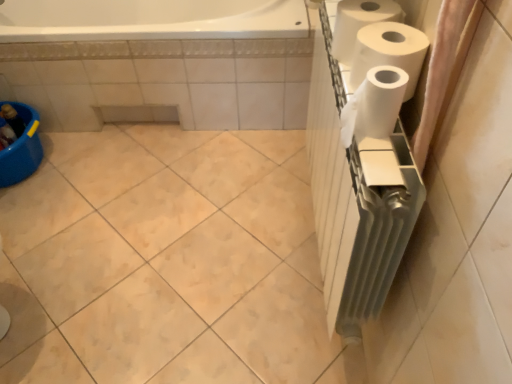
In order to click on white matte paper towel at right, which is the first paper towel in front-to-back order in this screenshot , I will do `click(374, 105)`.

How many degrees apart are the facing directions of white matte paper towel at right, the third paper towel when ordered from back to front, and white matte paper towel at upper right, the first paper towel in the back-to-front sequence?

A: The angle between the facing direction of white matte paper towel at right, the third paper towel when ordered from back to front, and the facing direction of white matte paper towel at upper right, the first paper towel in the back-to-front sequence, is 0.0052 degrees.

From the picture: How much distance is there between white matte paper towel at right, the third paper towel when ordered from back to front, and white matte paper towel at upper right, the first paper towel in the back-to-front sequence?

white matte paper towel at right, the third paper towel when ordered from back to front, and white matte paper towel at upper right, the first paper towel in the back-to-front sequence, are 6.44 inches apart from each other.

From a real-world perspective, which paper towel is the 2nd one underneath the white matte paper towel at right, the third paper towel when ordered from back to front? Please provide its 2D coordinates.

[(359, 23)]

From the image's perspective, is white matte paper towel at right, the third paper towel when ordered from back to front, located above white matte paper towel at upper right, the first paper towel in the back-to-front sequence?

Actually, white matte paper towel at right, the third paper towel when ordered from back to front, appears below white matte paper towel at upper right, the first paper towel in the back-to-front sequence, in the image.

Which is more distant, [355,10] or [371,33]?

The point [355,10] is farther.

Which of these two, white matte paper towel at upper right, placed as the third paper towel when sorted from front to back, or white matte paper towel at right, the second paper towel in the back-to-front sequence, is wider?

With larger width is white matte paper towel at right, the second paper towel in the back-to-front sequence.

Is white matte paper towel at upper right, placed as the third paper towel when sorted from front to back, bigger than white matte paper towel at right, which is the 2th paper towel in front-to-back order?

Incorrect, white matte paper towel at upper right, placed as the third paper towel when sorted from front to back, is not larger than white matte paper towel at right, which is the 2th paper towel in front-to-back order.

In the scene shown: Which of these two, white matte paper towel at upper right, the first paper towel in the back-to-front sequence, or white matte paper towel at right, which is the 2th paper towel in front-to-back order, stands shorter?

white matte paper towel at upper right, the first paper towel in the back-to-front sequence.

Is point (383, 2) closer or farther from the camera than point (368, 100)?

Point (383, 2) is farther from the camera than point (368, 100).

From the image's perspective, does white matte paper towel at upper right, placed as the third paper towel when sorted from front to back, appear higher than white matte paper towel at right, the third paper towel when ordered from back to front?

Yes.

Is white matte paper towel at upper right, the first paper towel in the back-to-front sequence, inside or outside of white matte paper towel at right, which is the first paper towel in front-to-back order?

white matte paper towel at upper right, the first paper towel in the back-to-front sequence, cannot be found inside white matte paper towel at right, which is the first paper towel in front-to-back order.

Could you tell me if pink fabric shower curtain at right is turned towards white matte paper towel at upper right, placed as the third paper towel when sorted from front to back?

No, pink fabric shower curtain at right is not facing towards white matte paper towel at upper right, placed as the third paper towel when sorted from front to back.

Locate an element on the screen. paper towel that is the 2nd one when counting upward from the pink fabric shower curtain at right (from the image's perspective) is located at coordinates (359, 23).

Considering the relative sizes of pink fabric shower curtain at right and white matte paper towel at upper right, the first paper towel in the back-to-front sequence, in the image provided, is pink fabric shower curtain at right wider than white matte paper towel at upper right, the first paper towel in the back-to-front sequence,?

Incorrect, the width of pink fabric shower curtain at right does not surpass that of white matte paper towel at upper right, the first paper towel in the back-to-front sequence.

Can we say white matte paper towel at right, the third paper towel when ordered from back to front, lies outside white matte paper towel at right, the second paper towel in the back-to-front sequence?

white matte paper towel at right, the third paper towel when ordered from back to front, is positioned outside white matte paper towel at right, the second paper towel in the back-to-front sequence.

From the image's perspective, between white matte paper towel at right, the third paper towel when ordered from back to front, and white matte paper towel at right, which is the 2th paper towel in front-to-back order, which one is located above?

white matte paper towel at right, which is the 2th paper towel in front-to-back order, from the image's perspective.

From a real-world perspective, which is physically below, white matte paper towel at right, which is the first paper towel in front-to-back order, or white matte paper towel at right, which is the 2th paper towel in front-to-back order?

white matte paper towel at right, which is the 2th paper towel in front-to-back order, from a real-world perspective.

Is white matte paper towel at right, the third paper towel when ordered from back to front, wider than white matte paper towel at right, which is the 2th paper towel in front-to-back order?

In fact, white matte paper towel at right, the third paper towel when ordered from back to front, might be narrower than white matte paper towel at right, which is the 2th paper towel in front-to-back order.

Is white matte paper towel at upper right, placed as the third paper towel when sorted from front to back, positioned far away from pink fabric shower curtain at right?

No, white matte paper towel at upper right, placed as the third paper towel when sorted from front to back, is in close proximity to pink fabric shower curtain at right.

Is white matte paper towel at upper right, placed as the third paper towel when sorted from front to back, bigger than pink fabric shower curtain at right?

A: Incorrect, white matte paper towel at upper right, placed as the third paper towel when sorted from front to back, is not larger than pink fabric shower curtain at right.

Can you confirm if white matte paper towel at upper right, placed as the third paper towel when sorted from front to back, is taller than pink fabric shower curtain at right?

Incorrect, the height of white matte paper towel at upper right, placed as the third paper towel when sorted from front to back, is not larger of that of pink fabric shower curtain at right.

From a real-world perspective, starting from the pink fabric shower curtain at right, which paper towel is the 3rd one below it? Please provide its 2D coordinates.

[(359, 23)]

Which object is positioned more to the right, white matte paper towel at right, the second paper towel in the back-to-front sequence, or white matte paper towel at upper right, the first paper towel in the back-to-front sequence?

white matte paper towel at right, the second paper towel in the back-to-front sequence, is more to the right.

Is white matte paper towel at right, the second paper towel in the back-to-front sequence, closer to camera compared to white matte paper towel at upper right, the first paper towel in the back-to-front sequence?

Yes, white matte paper towel at right, the second paper towel in the back-to-front sequence, is in front of white matte paper towel at upper right, the first paper towel in the back-to-front sequence.

Is white matte paper towel at right, which is the 2th paper towel in front-to-back order, oriented away from white matte paper towel at upper right, the first paper towel in the back-to-front sequence?

white matte paper towel at right, which is the 2th paper towel in front-to-back order, is not turned away from white matte paper towel at upper right, the first paper towel in the back-to-front sequence.

Between white matte paper towel at right, which is the 2th paper towel in front-to-back order, and white matte paper towel at upper right, placed as the third paper towel when sorted from front to back, which one has smaller size?

Smaller between the two is white matte paper towel at upper right, placed as the third paper towel when sorted from front to back.

Find the location of a particular element. This screenshot has height=384, width=512. the 1st paper towel counting from the right of the white matte paper towel at right, the third paper towel when ordered from back to front is located at coordinates (359, 23).

Where is `paper towel that is the 1st one when counting forward from the white matte paper towel at upper right, the first paper towel in the back-to-front sequence`? Image resolution: width=512 pixels, height=384 pixels. paper towel that is the 1st one when counting forward from the white matte paper towel at upper right, the first paper towel in the back-to-front sequence is located at coordinates (389, 51).

Estimate the real-world distances between objects in this image. Which object is further from pink fabric shower curtain at right, white matte paper towel at right, which is the first paper towel in front-to-back order, or white matte paper towel at upper right, the first paper towel in the back-to-front sequence?

white matte paper towel at upper right, the first paper towel in the back-to-front sequence, lies further to pink fabric shower curtain at right than the other object.

Considering their positions, is white matte paper towel at right, the third paper towel when ordered from back to front, positioned further to white matte paper towel at right, the second paper towel in the back-to-front sequence, than white matte paper towel at upper right, the first paper towel in the back-to-front sequence?

white matte paper towel at right, the third paper towel when ordered from back to front, is positioned further to the anchor white matte paper towel at right, the second paper towel in the back-to-front sequence.

Looking at the image, which one is located closer to white matte paper towel at right, which is the 2th paper towel in front-to-back order, pink fabric shower curtain at right or white matte paper towel at right, the third paper towel when ordered from back to front?

Among the two, white matte paper towel at right, the third paper towel when ordered from back to front, is located nearer to white matte paper towel at right, which is the 2th paper towel in front-to-back order.

Looking at the image, which one is located closer to white matte paper towel at right, which is the first paper towel in front-to-back order, pink fabric shower curtain at right or white matte paper towel at right, the second paper towel in the back-to-front sequence?

The object closer to white matte paper towel at right, which is the first paper towel in front-to-back order, is white matte paper towel at right, the second paper towel in the back-to-front sequence.

Which object lies nearer to the anchor point white matte paper towel at right, which is the 2th paper towel in front-to-back order, white matte paper towel at right, the third paper towel when ordered from back to front, or pink fabric shower curtain at right?

The object closer to white matte paper towel at right, which is the 2th paper towel in front-to-back order, is white matte paper towel at right, the third paper towel when ordered from back to front.

When comparing their distances from pink fabric shower curtain at right, does white matte paper towel at upper right, placed as the third paper towel when sorted from front to back, or white matte paper towel at right, the third paper towel when ordered from back to front, seem closer?

Among the two, white matte paper towel at right, the third paper towel when ordered from back to front, is located nearer to pink fabric shower curtain at right.

Considering their positions, is white matte paper towel at right, which is the 2th paper towel in front-to-back order, positioned closer to pink fabric shower curtain at right than white matte paper towel at right, which is the first paper towel in front-to-back order?

Based on the image, white matte paper towel at right, which is the first paper towel in front-to-back order, appears to be nearer to pink fabric shower curtain at right.

Based on their spatial positions, is white matte paper towel at right, the third paper towel when ordered from back to front, or pink fabric shower curtain at right closer to white matte paper towel at upper right, placed as the third paper towel when sorted from front to back?

white matte paper towel at right, the third paper towel when ordered from back to front, is closer to white matte paper towel at upper right, placed as the third paper towel when sorted from front to back.

Where is `paper towel between pink fabric shower curtain at right and white matte paper towel at right, which is the 2th paper towel in front-to-back order, in the front-back direction`? Image resolution: width=512 pixels, height=384 pixels. paper towel between pink fabric shower curtain at right and white matte paper towel at right, which is the 2th paper towel in front-to-back order, in the front-back direction is located at coordinates (374, 105).

Identify the location of paper towel that lies between white matte paper towel at upper right, the first paper towel in the back-to-front sequence, and white matte paper towel at right, the third paper towel when ordered from back to front, from top to bottom. Image resolution: width=512 pixels, height=384 pixels. (389, 51).